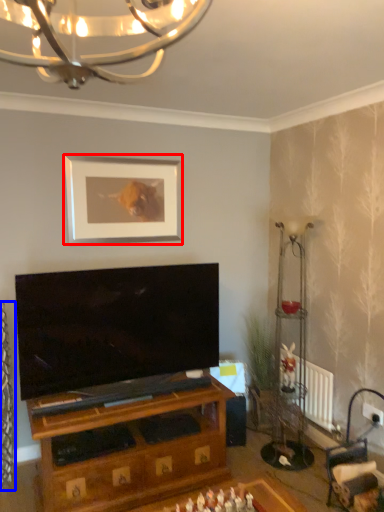
Question: Which object is closer to the camera taking this photo, picture frame (highlighted by a red box) or curtain (highlighted by a blue box)?

Choices:
 (A) picture frame
 (B) curtain

Answer: (B)